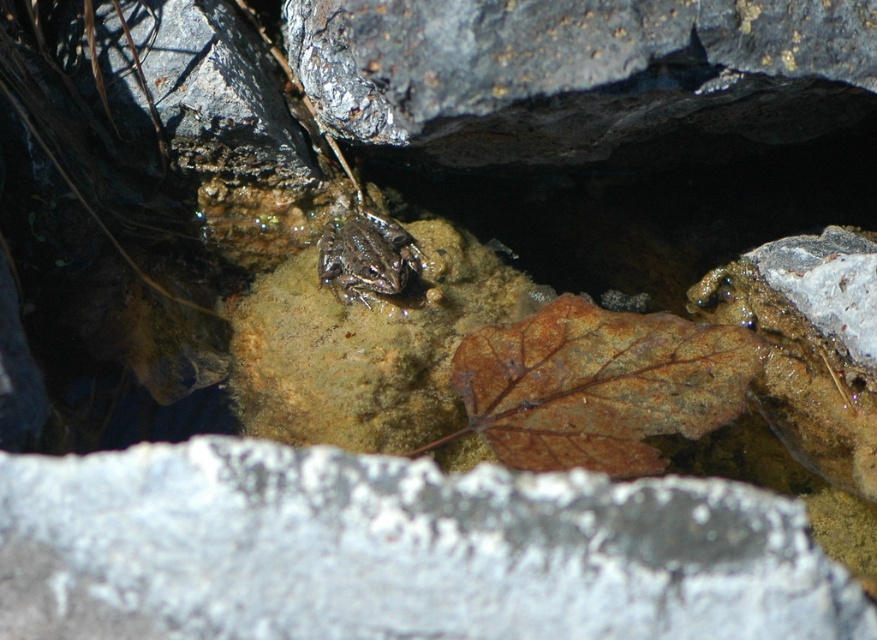
Can you confirm if white rough stone at center is shorter than camouflage skin frog at center?

Yes.

Is white rough stone at center in front of camouflage skin frog at center?

Yes, it is.

This screenshot has height=640, width=877. Identify the location of white rough stone at center. (398, 552).

Is rough gray rock at upper center above camouflage skin frog at center?

Correct, rough gray rock at upper center is located above camouflage skin frog at center.

Is point (718, 124) positioned after point (326, 246)?

No, it is not.

Identify the location of rough gray rock at upper center. The width and height of the screenshot is (877, 640). (576, 72).

In order to click on white rough stone at center in this screenshot , I will do `click(398, 552)`.

Can you confirm if white rough stone at center is taller than rough gray rock at upper center?

In fact, white rough stone at center may be shorter than rough gray rock at upper center.

Is point (294, 490) positioned behind point (476, 140)?

No, (294, 490) is closer to viewer.

Where is `white rough stone at center`? white rough stone at center is located at coordinates (398, 552).